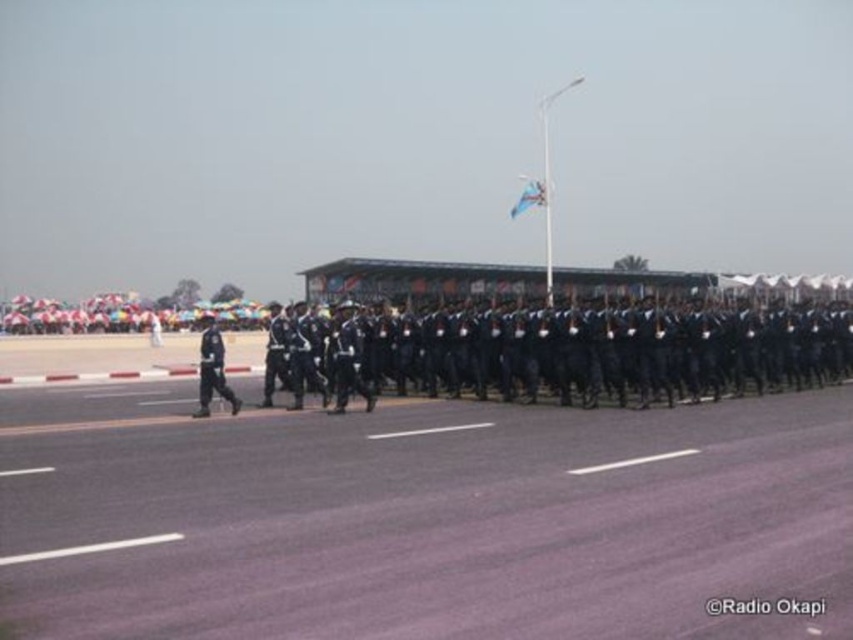
Question: From the image, what is the correct spatial relationship of black matte uniform at left in relation to blue fabric flag at center?

Choices:
 (A) left
 (B) right

Answer: (A)

Question: Is black uniformed soldiers at center to the left of blue fabric flag at center from the viewer's perspective?

Choices:
 (A) no
 (B) yes

Answer: (B)

Question: Which object appears closest to the camera in this image?

Choices:
 (A) blue fabric flag at center
 (B) black uniformed soldiers at center
 (C) black matte uniform at left

Answer: (C)

Question: Where is black matte uniform at left located in relation to blue fabric flag at center in the image?

Choices:
 (A) above
 (B) below

Answer: (B)

Question: Which point appears closest to the camera in this image?

Choices:
 (A) (525, 189)
 (B) (218, 368)
 (C) (442, 317)

Answer: (B)

Question: Which point is closer to the camera taking this photo?

Choices:
 (A) (456, 365)
 (B) (202, 412)
 (C) (531, 186)

Answer: (B)